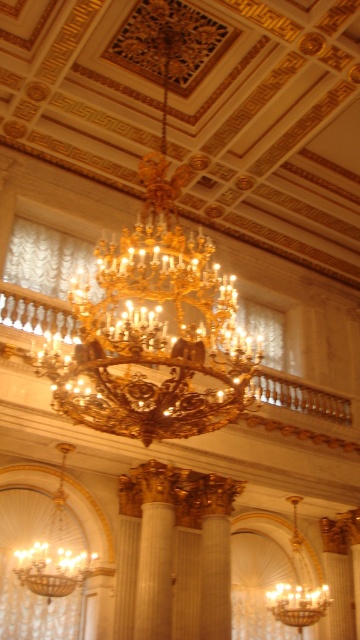
Question: Which of the following is the closest to the observer?

Choices:
 (A) gold metallic chandelier at center
 (B) matte gold chandelier at lower left

Answer: (B)

Question: Is matte gold chandelier at lower left wider than gold metallic chandelier at center?

Choices:
 (A) no
 (B) yes

Answer: (B)

Question: Can you confirm if matte gold chandelier at lower left is positioned below gold metallic chandelier at center?

Choices:
 (A) yes
 (B) no

Answer: (B)

Question: Which object appears closest to the camera in this image?

Choices:
 (A) matte gold chandelier at lower left
 (B) gold metallic chandelier at center

Answer: (A)

Question: Does matte gold chandelier at lower left appear on the left side of gold metallic chandelier at center?

Choices:
 (A) yes
 (B) no

Answer: (A)